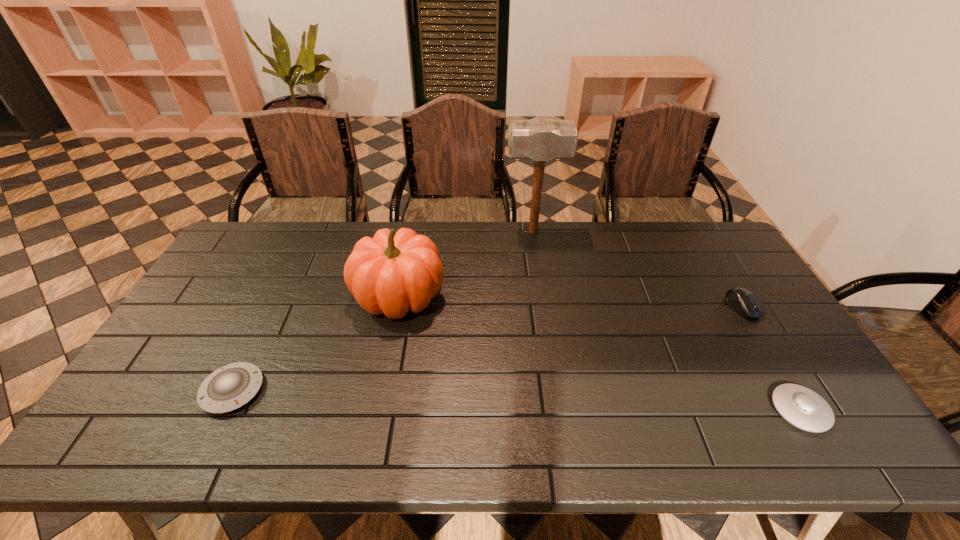
I want to click on unoccupied area between the fourth object from right to left and the left saucer, so click(x=316, y=343).

The height and width of the screenshot is (540, 960). In order to click on empty location between the pumpkin and the left saucer in this screenshot , I will do `click(316, 343)`.

Identify the location of vacant area that lies between the right saucer and the mallet. The image size is (960, 540). (666, 321).

You are a GUI agent. You are given a task and a screenshot of the screen. Output one action in this format:
    pyautogui.click(x=<x>, y=<y>)
    Task: Click on the vacant point located between the right saucer and the third object from left to right
    This screenshot has width=960, height=540.
    Given the screenshot: What is the action you would take?
    pyautogui.click(x=666, y=321)

Identify the location of the second closest object to the tallest object. (744, 302).

Identify the location of object that ranks as the closest to the left saucer. The width and height of the screenshot is (960, 540). (391, 273).

Locate an element on the screen. Image resolution: width=960 pixels, height=540 pixels. vacant space that satisfies the following two spatial constraints: 1. on the back side of the right saucer; 2. on the right side of the mouse is located at coordinates coord(738,308).

At what (x,y) coordinates should I click in order to perform the action: click on vacant space that satisfies the following two spatial constraints: 1. on the striking face of the mouse; 2. on the right side of the tallest object. Please return your answer as a coordinate pair (x, y). The height and width of the screenshot is (540, 960). Looking at the image, I should click on (544, 308).